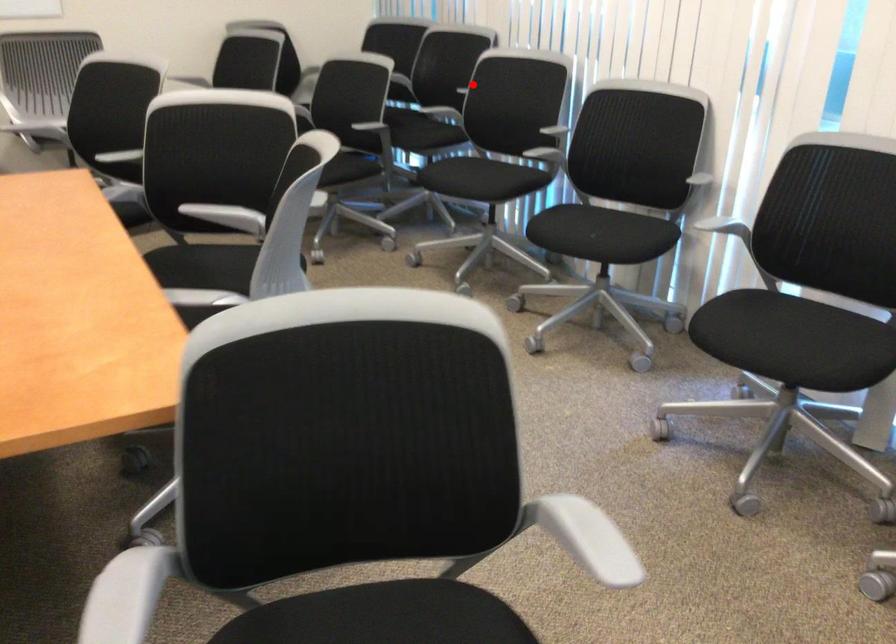
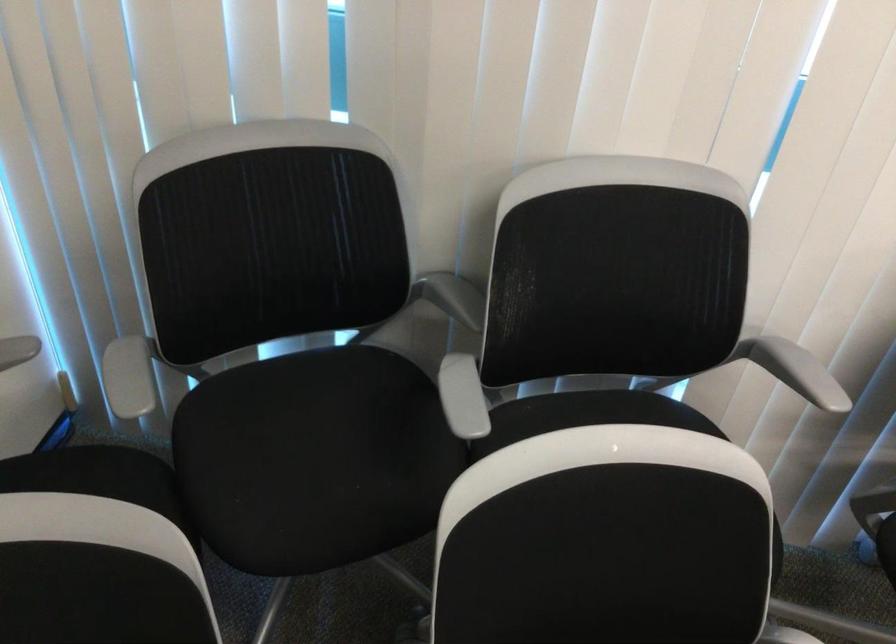
The point at the highlighted location is marked in the first image. Where is the corresponding point in the second image?

(794, 370)